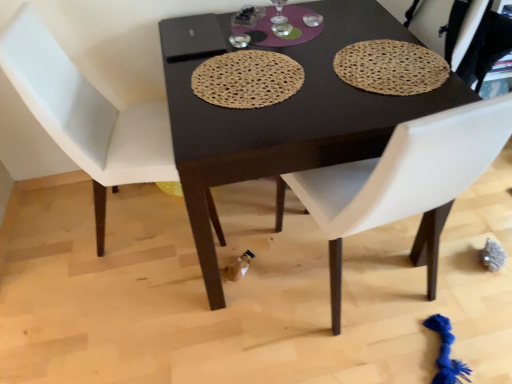
Locate an element on the screen. This screenshot has height=384, width=512. free point below white leather chair at center, positioned as the second chair in left-to-right order (from a real-world perspective) is located at coordinates (377, 296).